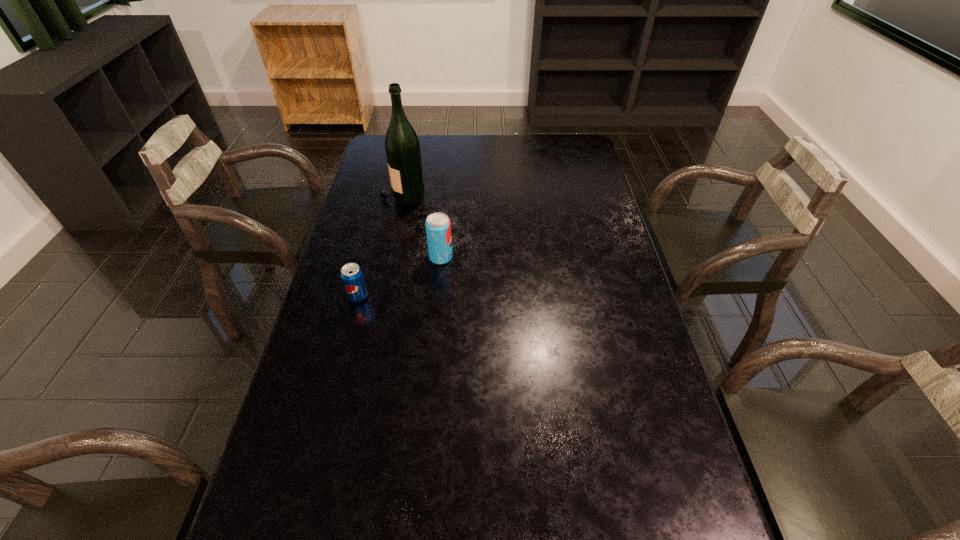
Select which object appears as the second closest to the wine bottle. Please provide its 2D coordinates. Your answer should be formatted as a tuple, i.e. [(x, y)], where the tuple contains the x and y coordinates of a point satisfying the conditions above.

[(351, 274)]